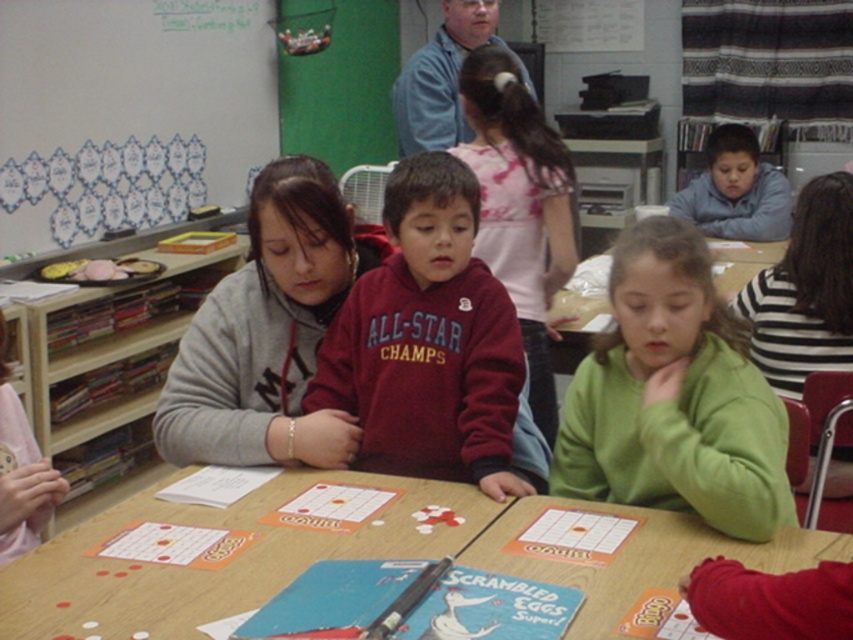
You are a teacher in the classroom and want to place a new poster on the wall directly above the green matte sweatshirt at center. Where should you position the poster?

The green matte sweatshirt at center is located at point 2D coordinates of (674, 397). Therefore, the poster should be placed directly above this coordinate on the wall.

You are a teacher observing the classroom scene. You notice the green matte sweatshirt at center and the blue cotton shirt at upper center. Which clothing item has a shorter length?

The green matte sweatshirt at center is shorter than the blue cotton shirt at upper center.